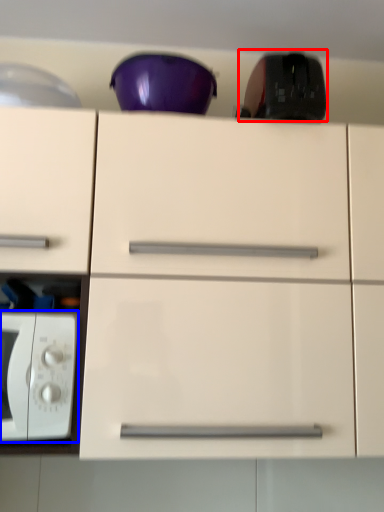
Question: Which object appears closest to the camera in this image, appliance (highlighted by a red box) or microwave oven (highlighted by a blue box)?

Choices:
 (A) appliance
 (B) microwave oven

Answer: (B)